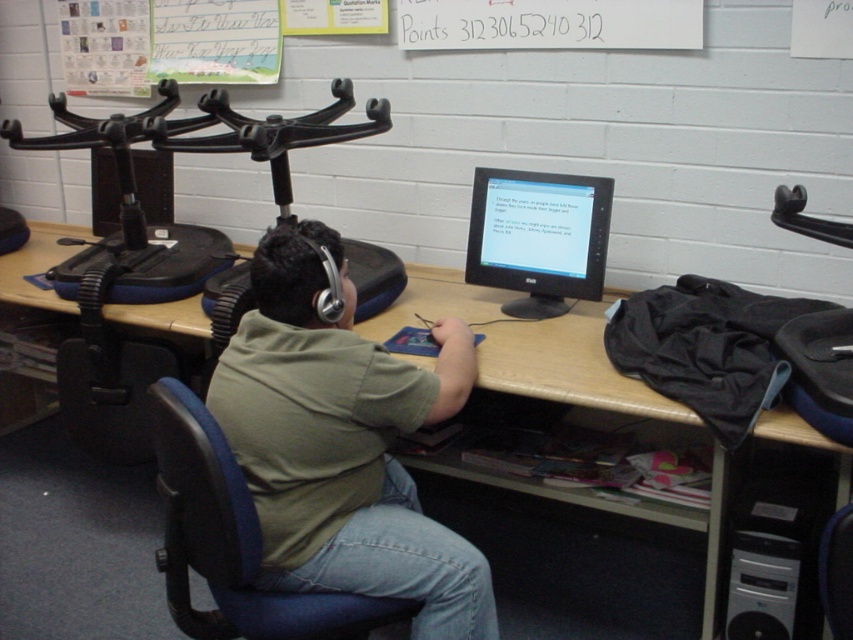
Does wooden at center have a smaller size compared to blue fabric swivel chair at center?

Incorrect, wooden at center is not smaller in size than blue fabric swivel chair at center.

Who is taller, wooden at center or blue fabric swivel chair at center?

Standing taller between the two is wooden at center.

Find the location of a particular element. wooden at center is located at coordinates (567, 365).

Identify the location of wooden at center. This screenshot has width=853, height=640. point(567,365).

Can you confirm if wooden at center is shorter than black matte monitor at center?

Incorrect, wooden at center's height does not fall short of black matte monitor at center's.

Is wooden at center below black matte monitor at center?

Yes.

Identify the location of wooden at center. (567, 365).

Identify the location of wooden at center. The width and height of the screenshot is (853, 640). (567, 365).

Measure the distance between point [796,572] and camera.

A distance of 1.81 meters exists between point [796,572] and camera.

Which is in front, point (757, 515) or point (827, 547)?

Point (827, 547)

Which is in front, point (758, 509) or point (843, 518)?

Positioned in front is point (843, 518).

The image size is (853, 640). Find the location of `white plastic computer tower at lower right`. white plastic computer tower at lower right is located at coordinates (773, 561).